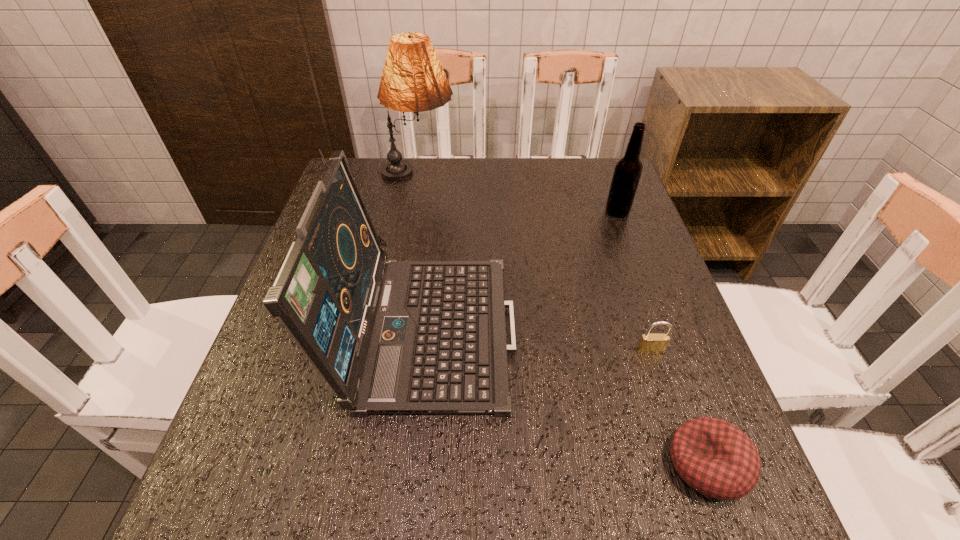
You are a GUI agent. You are given a task and a screenshot of the screen. Output one action in this format:
    pyautogui.click(x=<x>, y=<y>)
    Task: Click on the vacant space that is in between the farthest object and the shortest object
    This screenshot has width=960, height=540.
    Given the screenshot: What is the action you would take?
    pyautogui.click(x=563, y=321)

At what (x,y) coordinates should I click in order to perform the action: click on vacant area that lies between the nearest object and the padlock. Please return your answer as a coordinate pair (x, y). The width and height of the screenshot is (960, 540). Looking at the image, I should click on (679, 408).

The height and width of the screenshot is (540, 960). Find the location of `vacant space that's between the third tallest object and the fourth tallest object`. vacant space that's between the third tallest object and the fourth tallest object is located at coordinates (634, 281).

Locate an element on the screen. blank region between the nearest object and the farthest object is located at coordinates (563, 321).

Locate an element on the screen. The image size is (960, 540). free space between the padlock and the farthest object is located at coordinates (535, 264).

Find the location of `object that is the second nearest to the fourth tallest object`. object that is the second nearest to the fourth tallest object is located at coordinates [x=390, y=337].

Locate which object ranks fourth in proximity to the fourth shortest object. Please provide its 2D coordinates. Your answer should be formatted as a tuple, i.e. [(x, y)], where the tuple contains the x and y coordinates of a point satisfying the conditions above.

[(628, 169)]

Locate an element on the screen. Image resolution: width=960 pixels, height=540 pixels. free spot that satisfies the following two spatial constraints: 1. on the front-facing side of the farthest object; 2. on the back side of the beanbag is located at coordinates (366, 464).

At what (x,y) coordinates should I click in order to perform the action: click on free location that satisfies the following two spatial constraints: 1. on the front-facing side of the lampshade; 2. on the right side of the beer bottle. Please return your answer as a coordinate pair (x, y). Looking at the image, I should click on (412, 212).

Where is `vacant space that satisfies the following two spatial constraints: 1. on the front-facing side of the nearest object; 2. on the left side of the lampshade`? This screenshot has height=540, width=960. vacant space that satisfies the following two spatial constraints: 1. on the front-facing side of the nearest object; 2. on the left side of the lampshade is located at coordinates (366, 464).